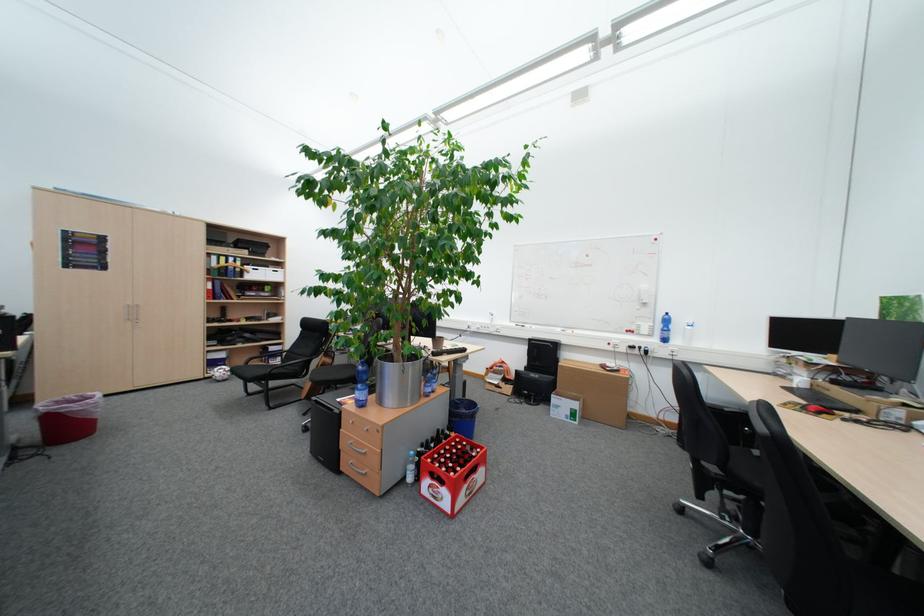
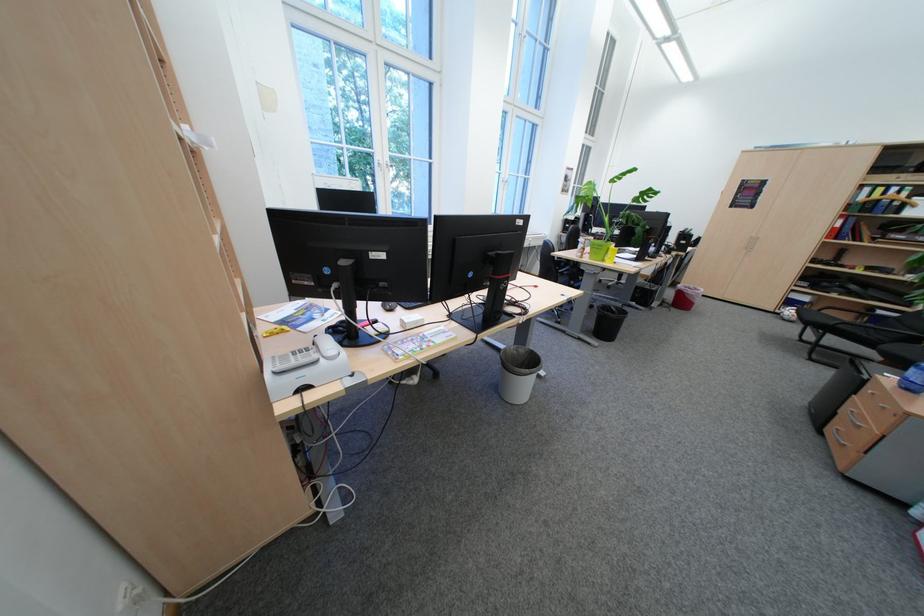
Locate, in the second image, the point that corresponds to (80,430) in the first image.

(694, 302)